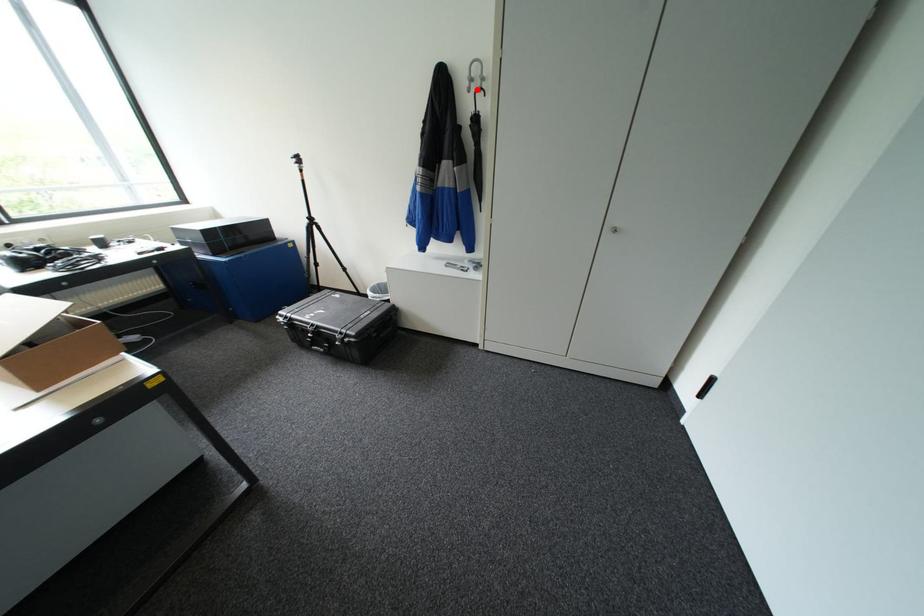
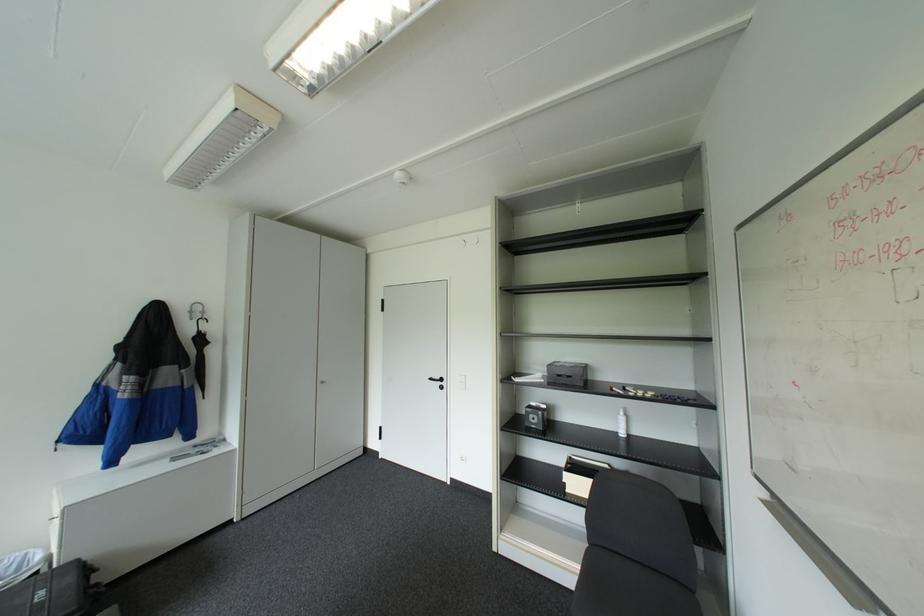
Question: I am providing you with two images of the same scene from different viewpoints. Image1 has a red point marked. In image2, the corresponding 3D location appears at what relative position? Reply with the corresponding letter.

Choices:
 (A) Closer
 (B) Farther

Answer: (B)